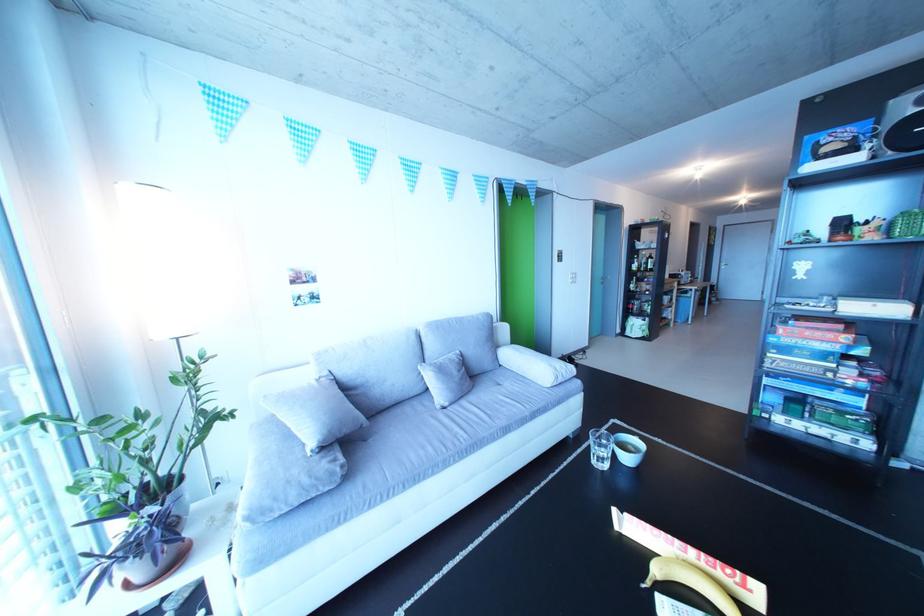
The height and width of the screenshot is (616, 924). In order to click on red board game box in this screenshot , I will do `click(691, 559)`.